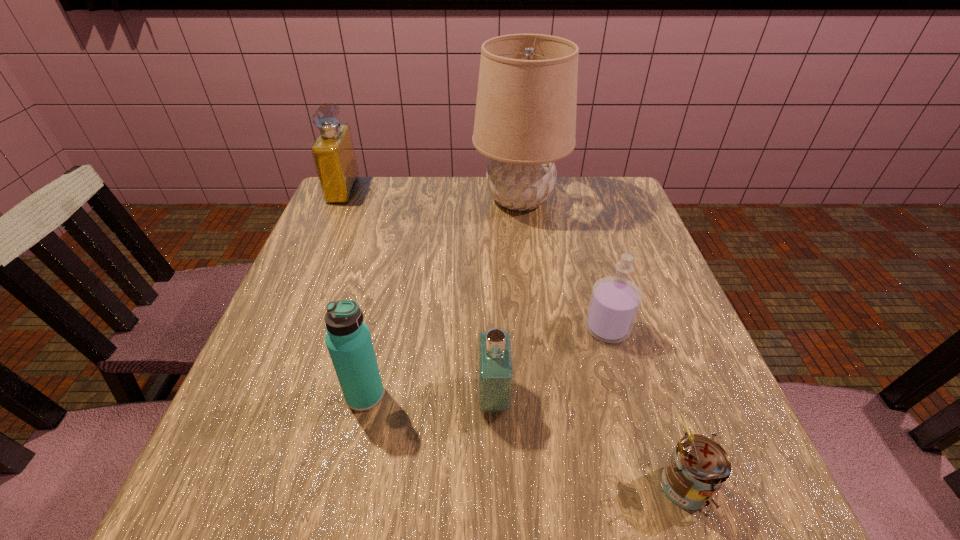
In order to click on lampshade in this screenshot , I will do [525, 119].

At what (x,y) coordinates should I click in order to perform the action: click on the farthest perfume. Please return your answer as a coordinate pair (x, y). This screenshot has width=960, height=540. Looking at the image, I should click on (333, 152).

The height and width of the screenshot is (540, 960). In order to click on the leftmost perfume in this screenshot , I will do `click(333, 152)`.

Where is `the second object from left to right`? Image resolution: width=960 pixels, height=540 pixels. the second object from left to right is located at coordinates (348, 340).

In order to click on the second farthest perfume in this screenshot , I will do `click(615, 301)`.

Identify the location of the rightmost perfume. (615, 301).

What are the coordinates of `the second perfume from right to left` in the screenshot? It's located at (495, 363).

This screenshot has height=540, width=960. What are the coordinates of `the nearest object` in the screenshot? It's located at (697, 469).

Identify the location of the shortest object. The width and height of the screenshot is (960, 540). (697, 469).

Identify the location of free space located 0.130m on the right of the lampshade. (613, 199).